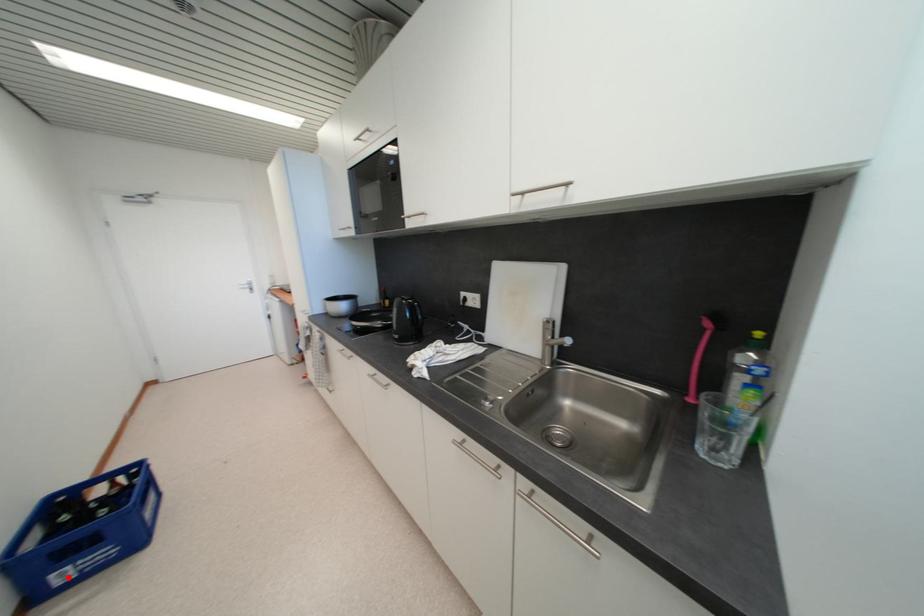
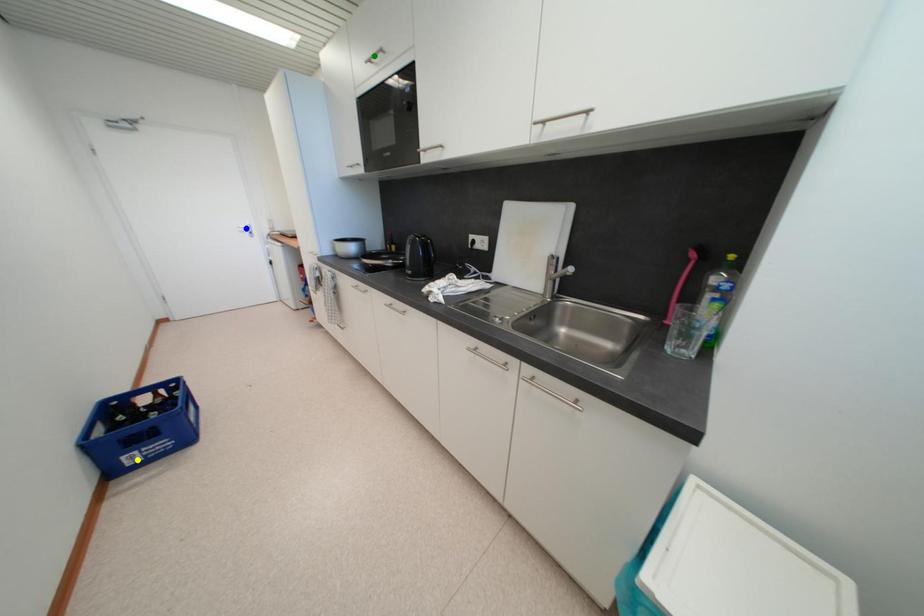
Question: I am providing you with two images of the same scene from different viewpoints. A red point is marked on the first image. You are given multiple points on the second image. Which spot in image 2 lines up with the point in image 1?

Choices:
 (A) blue point
 (B) yellow point
 (C) green point

Answer: (B)